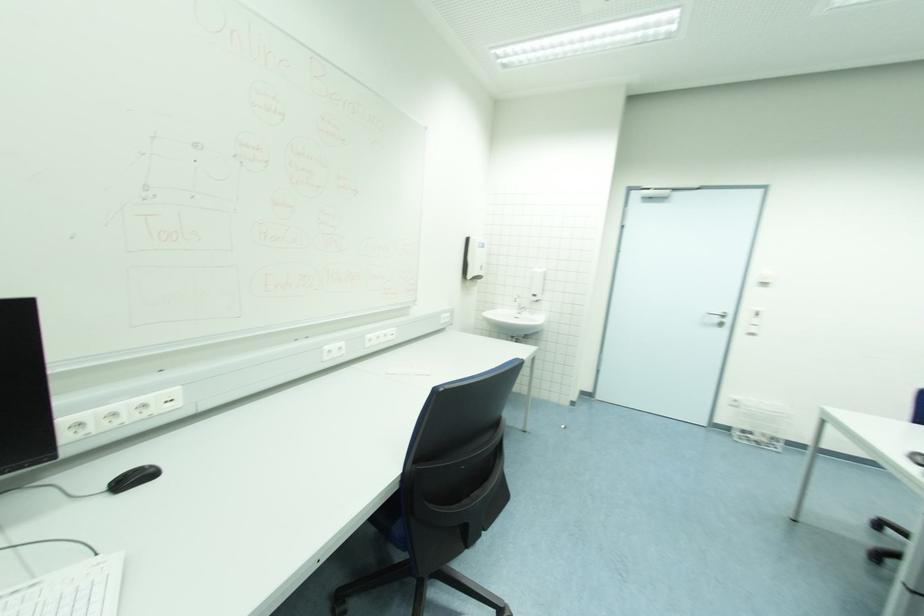
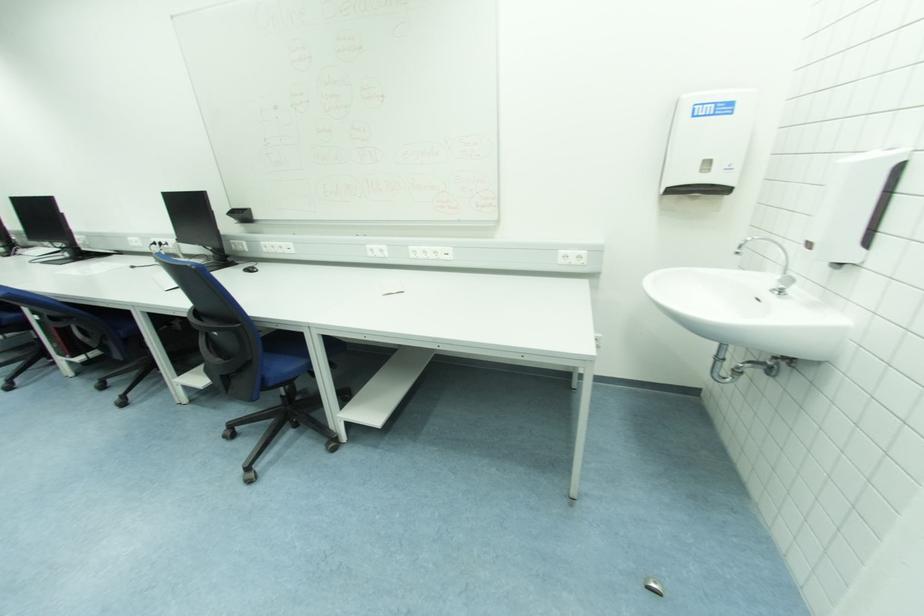
The point at (x=484, y=246) is marked in the first image. Where is the corresponding point in the second image?

(731, 110)